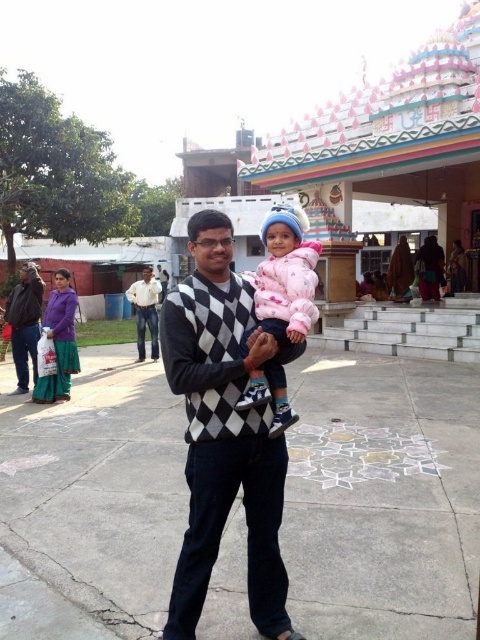
Question: Is pink fleece jacket at center further to camera compared to white cotton shirt at center?

Choices:
 (A) no
 (B) yes

Answer: (A)

Question: Is argyle sweater at center positioned behind pink fleece jacket at center?

Choices:
 (A) yes
 (B) no

Answer: (B)

Question: Considering the real-world distances, which object is farthest from the white cotton shirt at center?

Choices:
 (A) purple cotton dress at lower left
 (B) pink fleece jacket at center
 (C) argyle sweater at center

Answer: (B)

Question: Which of these objects is positioned farthest from the white cotton shirt at center?

Choices:
 (A) argyle sweater at center
 (B) purple cotton dress at lower left
 (C) pink fleece jacket at center

Answer: (C)

Question: Which point is farther to the camera?

Choices:
 (A) (277, 378)
 (B) (71, 372)
 (C) (214, 237)
 (D) (152, 310)

Answer: (D)

Question: Does purple cotton dress at lower left have a lesser width compared to white cotton shirt at center?

Choices:
 (A) no
 (B) yes

Answer: (B)